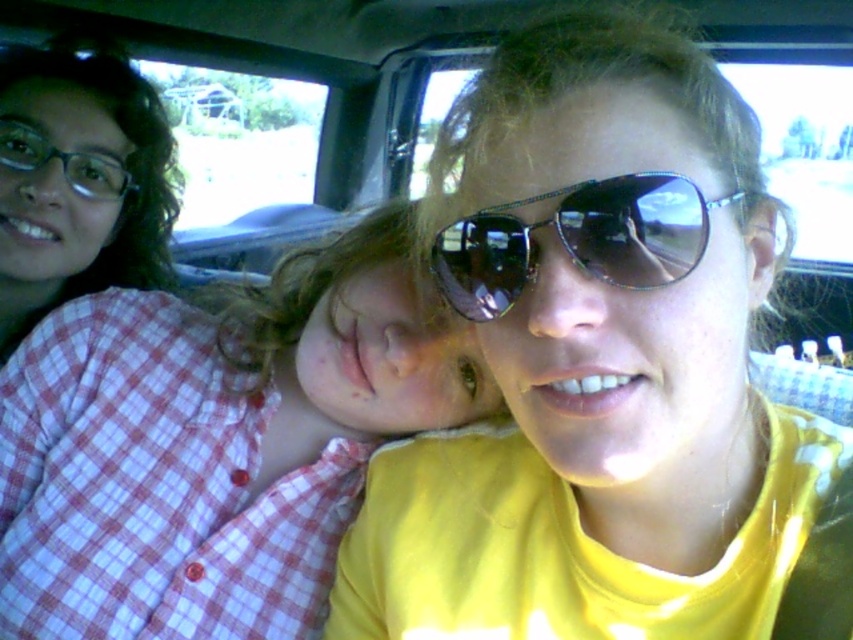
Question: Among these points, which one is nearest to the camera?

Choices:
 (A) (4, 150)
 (B) (35, 198)
 (C) (184, 326)
 (D) (593, 205)

Answer: (D)

Question: Does checkered fabric shirt at left have a larger size compared to plaid shirt at left?

Choices:
 (A) yes
 (B) no

Answer: (B)

Question: Is checkered fabric shirt at left further to the viewer compared to matte black glasses at upper left?

Choices:
 (A) yes
 (B) no

Answer: (B)

Question: Does checkered fabric shirt at left have a smaller size compared to metallic aviator sunglasses at center?

Choices:
 (A) no
 (B) yes

Answer: (A)

Question: Which point is farther from the camera taking this photo?

Choices:
 (A) (186, 397)
 (B) (590, 224)
 (C) (90, 195)

Answer: (C)

Question: Based on their relative distances, which object is farther from the matte black glasses at upper left?

Choices:
 (A) checkered fabric shirt at left
 (B) plaid shirt at left

Answer: (A)